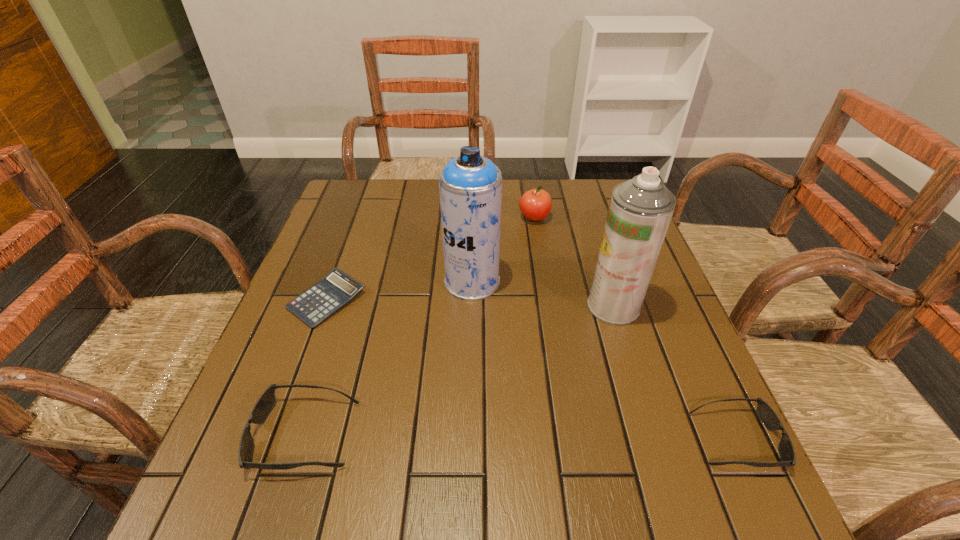
Where is `free point between the fourth object from left to right and the shortest object`? This screenshot has width=960, height=540. free point between the fourth object from left to right and the shortest object is located at coordinates (430, 259).

Identify the location of free space between the taller sunglasses and the shortest object. (316, 368).

In order to click on free space between the apple and the fourth object from right to left in this screenshot , I will do `click(503, 249)`.

This screenshot has width=960, height=540. In order to click on blank region between the rightmost object and the fifth object from left to right in this screenshot , I will do `click(675, 373)`.

The height and width of the screenshot is (540, 960). Find the location of `blank region between the rightmost object and the left sunglasses`. blank region between the rightmost object and the left sunglasses is located at coordinates (520, 437).

In order to click on vacant area that lies between the fourth object from right to left and the fifth tallest object in this screenshot , I will do `click(605, 360)`.

Locate which object is the closest to the left sunglasses. Please provide its 2D coordinates. Your answer should be formatted as a tuple, i.e. [(x, y)], where the tuple contains the x and y coordinates of a point satisfying the conditions above.

[(336, 289)]

Select which object is the third closest to the fourth object from right to left. Please provide its 2D coordinates. Your answer should be formatted as a tuple, i.e. [(x, y)], where the tuple contains the x and y coordinates of a point satisfying the conditions above.

[(640, 210)]

Where is `free point that satisfies the following two spatial constraints: 1. on the front side of the left aerosol can; 2. on the front-facing side of the left sunglasses`? free point that satisfies the following two spatial constraints: 1. on the front side of the left aerosol can; 2. on the front-facing side of the left sunglasses is located at coordinates (469, 435).

You are a GUI agent. You are given a task and a screenshot of the screen. Output one action in this format:
    pyautogui.click(x=<x>, y=<y>)
    Task: Click on the free spot that satisfies the following two spatial constraints: 1. on the front side of the apple; 2. on the left side of the right aerosol can
    The height and width of the screenshot is (540, 960).
    Given the screenshot: What is the action you would take?
    pyautogui.click(x=548, y=306)